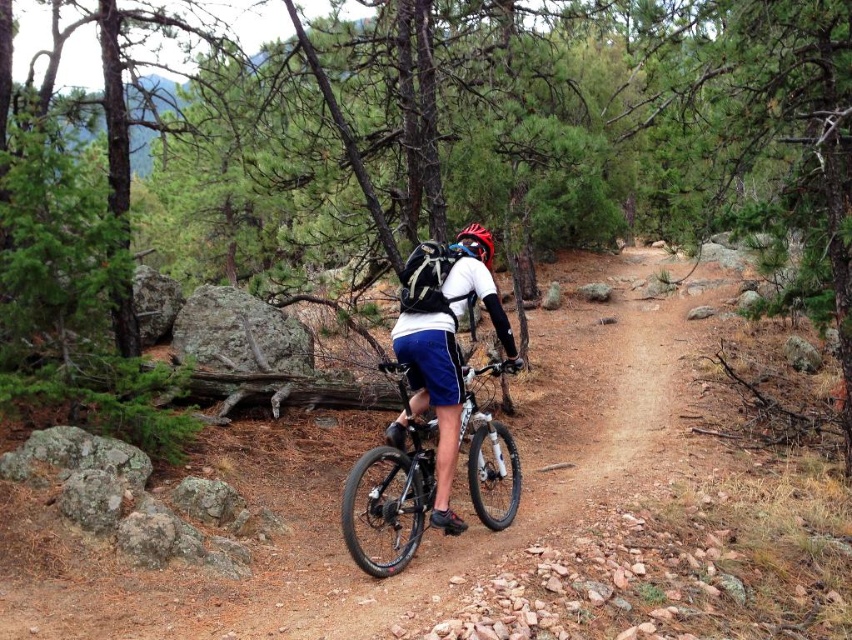
Between matte blue shorts at center and shiny black frame at center, which one is positioned higher?

matte blue shorts at center

Which is below, matte blue shorts at center or shiny black frame at center?

shiny black frame at center

Locate an element on the screen. The height and width of the screenshot is (640, 852). matte blue shorts at center is located at coordinates (442, 348).

Between matte blue shorts at center and matte red bicycle helmet at center, which one has less height?

matte red bicycle helmet at center is shorter.

Who is more distant from viewer, (432, 404) or (464, 243)?

The point (464, 243) is more distant.

You are a GUI agent. You are given a task and a screenshot of the screen. Output one action in this format:
    pyautogui.click(x=<x>, y=<y>)
    Task: Click on the matte blue shorts at center
    This screenshot has height=640, width=852.
    Given the screenshot: What is the action you would take?
    pyautogui.click(x=442, y=348)

Who is more forward, (491, 528) or (476, 256)?

Point (476, 256) is in front.

Does shiny black frame at center come in front of matte red bicycle helmet at center?

That is True.

Locate an element on the screen. This screenshot has height=640, width=852. shiny black frame at center is located at coordinates click(x=390, y=499).